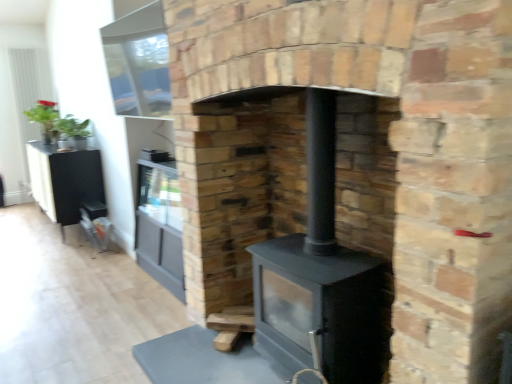
Question: From the image's perspective, is black matte wood stove at center beneath black matte entertainment center at left?

Choices:
 (A) yes
 (B) no

Answer: (A)

Question: Does black matte wood stove at center turn towards black matte entertainment center at left?

Choices:
 (A) no
 (B) yes

Answer: (A)

Question: Does black matte wood stove at center have a greater width compared to black matte entertainment center at left?

Choices:
 (A) no
 (B) yes

Answer: (B)

Question: Is black matte wood stove at center taller than black matte entertainment center at left?

Choices:
 (A) no
 (B) yes

Answer: (B)

Question: From a real-world perspective, is black matte wood stove at center located beneath black matte entertainment center at left?

Choices:
 (A) yes
 (B) no

Answer: (B)

Question: From a real-world perspective, is black matte wood stove at center located higher than black matte entertainment center at left?

Choices:
 (A) yes
 (B) no

Answer: (A)

Question: Does black matte wood burning stove at center appear on the left side of black matte wood stove at center?

Choices:
 (A) no
 (B) yes

Answer: (A)

Question: Is the position of black matte wood burning stove at center less distant than that of black matte wood stove at center?

Choices:
 (A) no
 (B) yes

Answer: (A)

Question: Does black matte wood burning stove at center have a smaller size compared to black matte wood stove at center?

Choices:
 (A) no
 (B) yes

Answer: (B)

Question: Could you tell me if black matte wood burning stove at center is facing black matte wood stove at center?

Choices:
 (A) yes
 (B) no

Answer: (A)

Question: From a real-world perspective, is black matte wood burning stove at center positioned under black matte wood stove at center based on gravity?

Choices:
 (A) no
 (B) yes

Answer: (B)

Question: Is black matte wood burning stove at center positioned with its back to black matte wood stove at center?

Choices:
 (A) yes
 (B) no

Answer: (A)

Question: From a real-world perspective, is black matte entertainment center at left located higher than black matte wood burning stove at center?

Choices:
 (A) no
 (B) yes

Answer: (A)